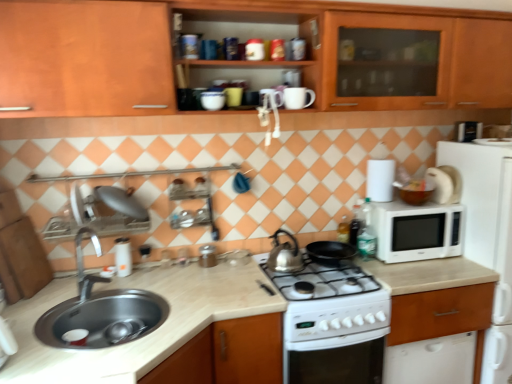
Question: Based on their positions, is metallic silver canister at center, the second appliance positioned from the back, located to the left or right of wooden cabinet at upper center, which appears as the first cabinetry when viewed from the top?

Choices:
 (A) right
 (B) left

Answer: (B)

Question: Is metallic silver canister at center, marked as the 2th appliance in a right-to-left arrangement, situated inside wooden cabinet at upper center, which appears as the first cabinetry when viewed from the top, or outside?

Choices:
 (A) outside
 (B) inside

Answer: (A)

Question: Which object is the closest to the white glossy water filter at left, positioned as the second appliance in top-to-bottom order?

Choices:
 (A) wooden cabinet at right, which is the 1th cabinetry from bottom to top
 (B) white matte microwave at right
 (C) white glossy oven at center
 (D) satin silver kettle at center
 (E) white marble countertop at lower left

Answer: (E)

Question: Which is nearer to the silver metallic faucet at sink left?

Choices:
 (A) white glossy oven at center
 (B) white marble countertop at lower left
 (C) metallic silver canister at center, which is counted as the 2th appliance, starting from the left
 (D) white matte paper towel at upper right
 (E) matte wood cabinet at left, the second cabinetry viewed from the top

Answer: (E)